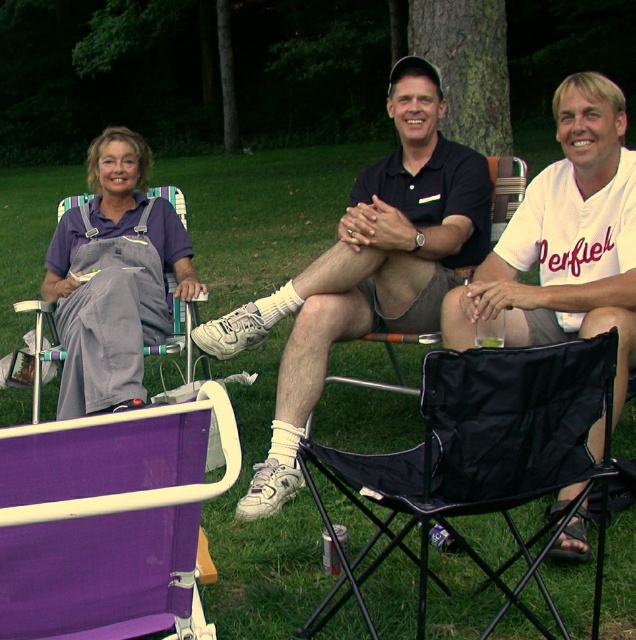
Where is `matte black polo shirt at center`? The image size is (636, 640). matte black polo shirt at center is located at coordinates (366, 269).

The height and width of the screenshot is (640, 636). Describe the element at coordinates (366, 269) in the screenshot. I see `matte black polo shirt at center` at that location.

The image size is (636, 640). Find the location of `matte black polo shirt at center`. matte black polo shirt at center is located at coordinates (366, 269).

Is point (308, 481) positioned behind point (404, 77)?

No, it is not.

Between black fabric folding chair at center and matte black polo shirt at center, which one appears on the left side from the viewer's perspective?

From the viewer's perspective, matte black polo shirt at center appears more on the left side.

The image size is (636, 640). Find the location of `black fabric folding chair at center`. black fabric folding chair at center is located at coordinates (477, 451).

Where is `black fabric folding chair at center`? The height and width of the screenshot is (640, 636). black fabric folding chair at center is located at coordinates (477, 451).

Which is behind, point (135, 458) or point (60, 330)?

The point (60, 330) is more distant.

Locate an element on the screen. The width and height of the screenshot is (636, 640). purple fabric beach chair at left is located at coordinates (106, 518).

Locate an element on the screen. purple fabric beach chair at left is located at coordinates (106, 518).